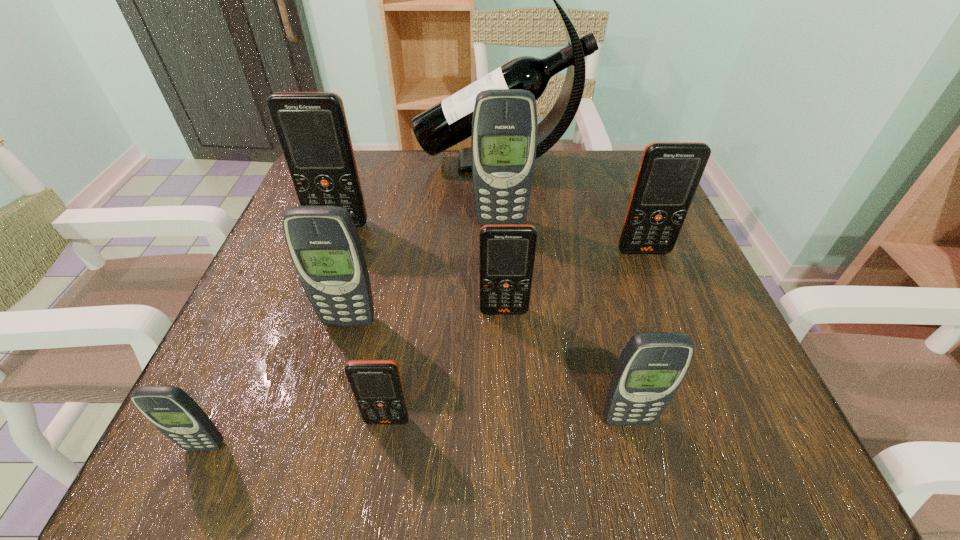
I want to click on orange cellular telephone that is the closest to the second orange cellular telephone from left to right, so click(x=507, y=252).

Identify which gray cellular telephone is the second nearest to the sixth farthest object. Please provide its 2D coordinates. Your answer should be formatted as a tuple, i.e. [(x, y)], where the tuple contains the x and y coordinates of a point satisfying the conditions above.

[(504, 127)]

Locate an element on the screen. This screenshot has height=540, width=960. gray cellular telephone that is the second closest to the third farthest gray cellular telephone is located at coordinates (504, 127).

This screenshot has height=540, width=960. What are the coordinates of `free space that satisfies the following two spatial constraints: 1. on the stand of the wine bottle; 2. on the screen of the fourth nearest object` in the screenshot? It's located at (506, 322).

What are the coordinates of `free space in the image that satisfies the following two spatial constraints: 1. on the stand of the wine bottle; 2. on the screen of the smallest gray cellular telephone` in the screenshot? It's located at (513, 446).